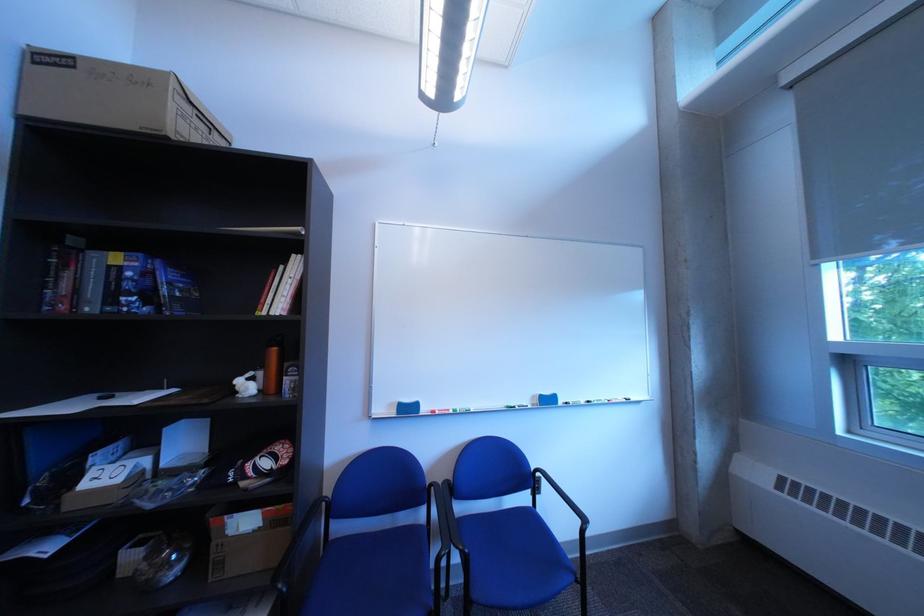
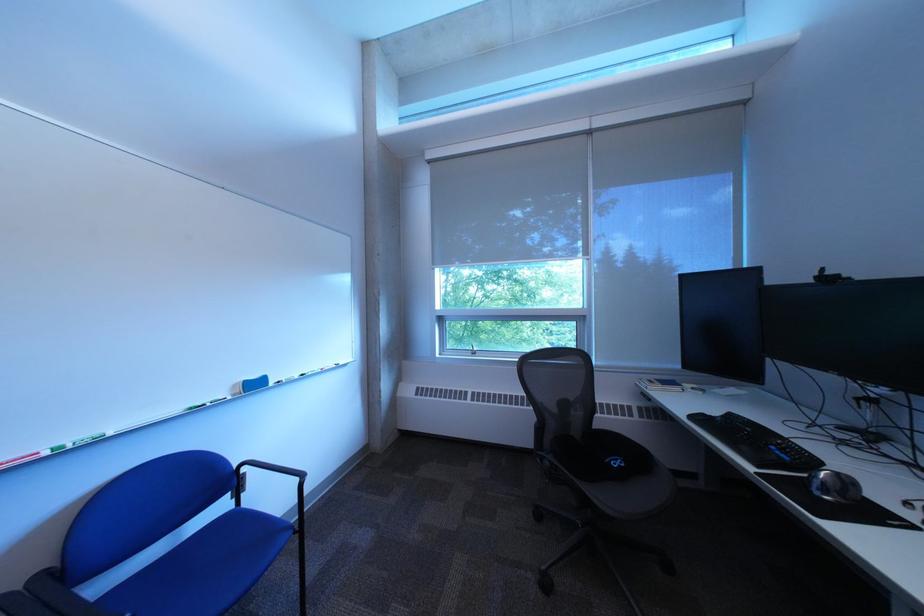
Where in the second image is the point corresponding to pixel 545 506 from the first image?

(248, 508)